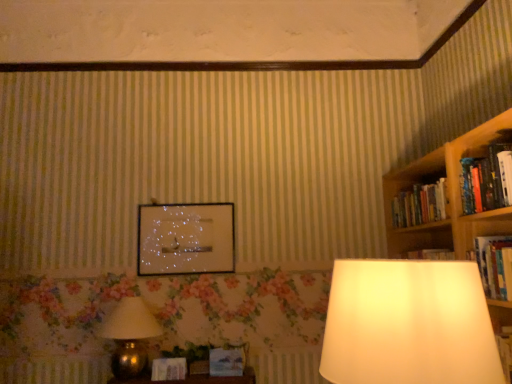
Question: From a real-world perspective, is gold metallic lamp at lower left above or below wooden bookshelf at right?

Choices:
 (A) below
 (B) above

Answer: (A)

Question: In terms of size, does gold metallic lamp at lower left appear bigger or smaller than wooden bookshelf at right?

Choices:
 (A) small
 (B) big

Answer: (B)

Question: Estimate the real-world distances between objects in this image. Which object is farther from the glossy glass picture frame at center?

Choices:
 (A) hardcover book at right, the 1th book positioned from the bottom
 (B) matte brown book at lower center, which appears as the 2th paperback book when viewed from the right
 (C) gold metallic lamp at lower left
 (D) wooden bookshelf at right
 (E) matte blue paperback book at center, acting as the second paperback book starting from the left

Answer: (A)

Question: Which object is the farthest from the wooden bookshelf at right?

Choices:
 (A) matte brown book at lower center, marked as the 1th paperback book in a left-to-right arrangement
 (B) hardcover book at right, arranged as the 2th book when viewed from the top
 (C) gold metallic lamp at lower left
 (D) hardcover book at upper right, placed as the 1th book when sorted from top to bottom
 (E) matte blue paperback book at center, the first paperback book positioned from the right

Answer: (C)